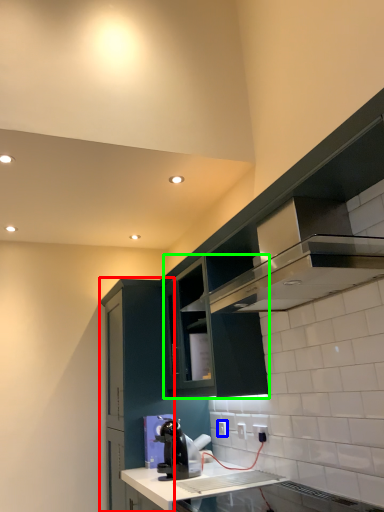
Question: Which object is positioned closest to cabinetry (highlighted by a red box)? Select from electric outlet (highlighted by a blue box) and cabinetry (highlighted by a green box).

Choices:
 (A) electric outlet
 (B) cabinetry

Answer: (B)